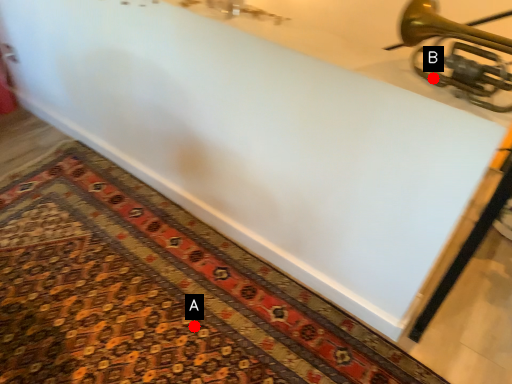
Question: Two points are circled on the image, labeled by A and B beside each circle. Which point is closer to the camera taking this photo?

Choices:
 (A) A is closer
 (B) B is closer

Answer: (B)